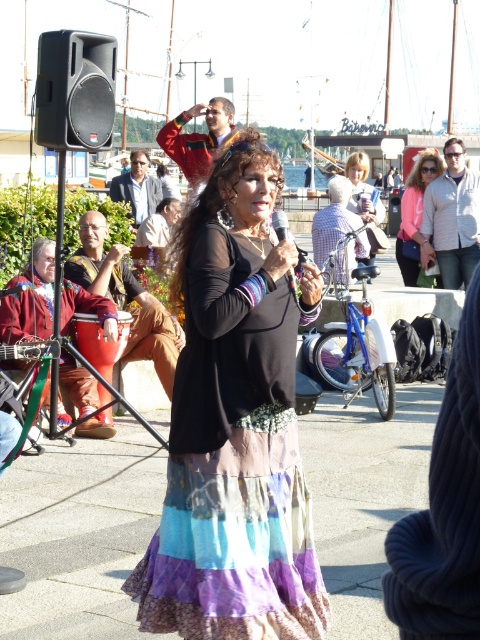
Is black plastic speaker at upper left in front of light brown hair at center?

Yes.

Which is below, black plastic speaker at upper left or light brown hair at center?

light brown hair at center

Does point (36, 124) come closer to viewer compared to point (375, 218)?

Yes, it is.

Where is `black plastic speaker at upper left`? The width and height of the screenshot is (480, 640). black plastic speaker at upper left is located at coordinates (74, 90).

Does multicolored patchwork skirt at center have a greater width compared to brown leather drum at center?

Incorrect, multicolored patchwork skirt at center's width does not surpass brown leather drum at center's.

Is multicolored patchwork skirt at center bigger than brown leather drum at center?

No, multicolored patchwork skirt at center is not bigger than brown leather drum at center.

Who is more distant from viewer, (x=267, y=298) or (x=140, y=353)?

The point (x=140, y=353) is behind.

The width and height of the screenshot is (480, 640). In order to click on multicolored patchwork skirt at center in this screenshot , I will do `click(233, 461)`.

Which of these two, brown leather drum at center or light brown hair at center, stands shorter?

With less height is light brown hair at center.

Does brown leather drum at center have a greater height compared to light brown hair at center?

Correct, brown leather drum at center is much taller as light brown hair at center.

Between point (108, 419) and point (354, 208), which one is positioned behind?

Point (354, 208)

Locate an element on the screen. brown leather drum at center is located at coordinates (126, 298).